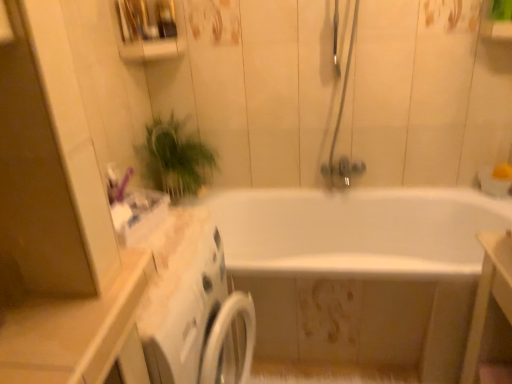
Question: Considering the positions of white glossy bathtub at center and white glossy vanity at lower right in the image, is white glossy bathtub at center taller or shorter than white glossy vanity at lower right?

Choices:
 (A) tall
 (B) short

Answer: (B)

Question: Is white glossy bathtub at center inside or outside of white glossy vanity at lower right?

Choices:
 (A) outside
 (B) inside

Answer: (A)

Question: Which object is the closest to the white glossy vanity at lower right?

Choices:
 (A) matte silver shower door at upper center
 (B) green leafy plant at upper left
 (C) white glossy bathtub at center

Answer: (C)

Question: Considering the real-world distances, which object is farthest from the white glossy bathtub at center?

Choices:
 (A) white glossy vanity at lower right
 (B) green leafy plant at upper left
 (C) matte silver shower door at upper center

Answer: (A)